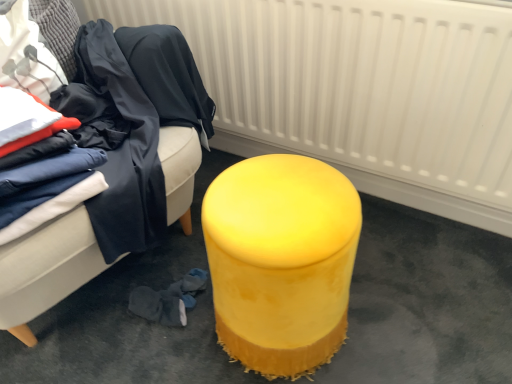
The height and width of the screenshot is (384, 512). What do you see at coordinates (281, 261) in the screenshot? I see `yellow velvet ottoman at center` at bounding box center [281, 261].

Find the location of a particular element. yellow velvet ottoman at center is located at coordinates (426, 302).

Measure the distance between yellow velvet ottoman at center and camera.

The distance of yellow velvet ottoman at center from camera is 1.00 meters.

The image size is (512, 384). What are the coordinates of `velvet yellow ottoman at right` in the screenshot? It's located at (45, 271).

The width and height of the screenshot is (512, 384). In order to click on yellow velvet ottoman at center in this screenshot , I will do `click(281, 261)`.

Considering the sizes of objects white textured radiator at upper center and dark blue fabric at left in the image provided, who is shorter, white textured radiator at upper center or dark blue fabric at left?

Standing shorter between the two is dark blue fabric at left.

Are white textured radiator at upper center and dark blue fabric at left beside each other?

No, white textured radiator at upper center is not making contact with dark blue fabric at left.

Does point (385, 84) come farther from viewer compared to point (201, 89)?

That is False.

Visually, is white textured radiator at upper center positioned to the left or to the right of dark blue fabric at left?

Based on their positions, white textured radiator at upper center is located to the right of dark blue fabric at left.

Could you tell me if dark blue fabric at left is turned towards yellow velvet ottoman at center?

No, dark blue fabric at left is not facing towards yellow velvet ottoman at center.

Which is in front, point (149, 61) or point (42, 348)?

The point (149, 61) is in front.

Does dark blue fabric at left have a larger size compared to yellow velvet ottoman at center?

No, dark blue fabric at left is not bigger than yellow velvet ottoman at center.

How different are the orientations of dark blue fabric at left and yellow velvet ottoman at center in degrees?

dark blue fabric at left and yellow velvet ottoman at center are facing 70.1 degrees away from each other.

Which of these two, yellow velvet ottoman at center or white textured radiator at upper center, is smaller?

yellow velvet ottoman at center is smaller.

Choose the correct answer: Is yellow velvet ottoman at center inside white textured radiator at upper center or outside it?

yellow velvet ottoman at center is not enclosed by white textured radiator at upper center.

Is white textured radiator at upper center at the back of yellow velvet ottoman at center?

Yes, yellow velvet ottoman at center's orientation is away from white textured radiator at upper center.

You are a GUI agent. You are given a task and a screenshot of the screen. Output one action in this format:
    pyautogui.click(x=<x>, y=<y>)
    Task: Click on the stool below the white textured radiator at upper center (from the image's perspective)
    
    Given the screenshot: What is the action you would take?
    pyautogui.click(x=281, y=261)

Who is taller, white textured radiator at upper center or velvet yellow ottoman at right?

velvet yellow ottoman at right.

How many degrees apart are the facing directions of white textured radiator at upper center and velvet yellow ottoman at right?

The angle between the facing direction of white textured radiator at upper center and the facing direction of velvet yellow ottoman at right is 69.8 degrees.

Can you confirm if white textured radiator at upper center is wider than velvet yellow ottoman at right?

No, white textured radiator at upper center is not wider than velvet yellow ottoman at right.

Does point (400, 161) appear closer or farther from the camera than point (72, 291)?

Clearly, point (400, 161) is more distant from the camera than point (72, 291).

Consider the image. Is yellow velvet ottoman at center positioned with its back to white textured radiator at upper center?

yellow velvet ottoman at center is not turned away from white textured radiator at upper center.

How much distance is there between yellow velvet ottoman at center and white textured radiator at upper center?

yellow velvet ottoman at center is 16.31 inches away from white textured radiator at upper center.

Does point (458, 280) appear closer or farther from the camera than point (371, 101)?

Point (458, 280) appears to be farther away from the viewer than point (371, 101).

Is white textured radiator at upper center at the back of dark blue fabric at left?

No.

Is there a large distance between dark blue fabric at left and white textured radiator at upper center?

No, dark blue fabric at left is not far from white textured radiator at upper center.

Considering the relative positions of dark blue fabric at left and white textured radiator at upper center in the image provided, is dark blue fabric at left to the left of white textured radiator at upper center from the viewer's perspective?

Correct, you'll find dark blue fabric at left to the left of white textured radiator at upper center.

Based on their sizes in the image, would you say yellow velvet ottoman at center is bigger or smaller than yellow velvet ottoman at center?

In the image, yellow velvet ottoman at center appears to be smaller than yellow velvet ottoman at center.

Is the position of yellow velvet ottoman at center less distant than that of yellow velvet ottoman at center?

No, yellow velvet ottoman at center is further to the viewer.

Considering the relative sizes of yellow velvet ottoman at center and yellow velvet ottoman at center in the image provided, is yellow velvet ottoman at center shorter than yellow velvet ottoman at center?

In fact, yellow velvet ottoman at center may be taller than yellow velvet ottoman at center.

In the image, is yellow velvet ottoman at center on the left side or the right side of yellow velvet ottoman at center?

yellow velvet ottoman at center is to the right of yellow velvet ottoman at center.

Identify the location of radiator located on the right of dark blue fabric at left. (359, 90).

Find the location of `concrete that appears in front of the dark blue fabric at left`. concrete that appears in front of the dark blue fabric at left is located at coordinates (426, 302).

Based on the photo, from the image, which object appears to be nearer to velvet yellow ottoman at right, yellow velvet ottoman at center or yellow velvet ottoman at center?

yellow velvet ottoman at center is positioned closer to the anchor velvet yellow ottoman at right.

Based on their spatial positions, is dark blue fabric at left or yellow velvet ottoman at center further from white textured radiator at upper center?

yellow velvet ottoman at center.

Looking at the image, which one is located further to white textured radiator at upper center, dark blue fabric at left or velvet yellow ottoman at right?

The object further to white textured radiator at upper center is velvet yellow ottoman at right.

Considering their positions, is white textured radiator at upper center positioned closer to velvet yellow ottoman at right than yellow velvet ottoman at center?

The object closer to velvet yellow ottoman at right is yellow velvet ottoman at center.

When comparing their distances from velvet yellow ottoman at right, does white textured radiator at upper center or yellow velvet ottoman at center seem further?

Among the two, white textured radiator at upper center is located further to velvet yellow ottoman at right.

From the image, which object appears to be nearer to velvet yellow ottoman at right, white textured radiator at upper center or dark blue fabric at left?

dark blue fabric at left lies closer to velvet yellow ottoman at right than the other object.

Which object lies further to the anchor point dark blue fabric at left, velvet yellow ottoman at right or white textured radiator at upper center?

Based on the image, velvet yellow ottoman at right appears to be further to dark blue fabric at left.

Based on the photo, from the image, which object appears to be nearer to dark blue fabric at left, yellow velvet ottoman at center or white textured radiator at upper center?

Among the two, white textured radiator at upper center is located nearer to dark blue fabric at left.

Where is `clothing between velvet yellow ottoman at right and white textured radiator at upper center from left to right`? Image resolution: width=512 pixels, height=384 pixels. clothing between velvet yellow ottoman at right and white textured radiator at upper center from left to right is located at coordinates (168, 76).

Identify the location of stool between velvet yellow ottoman at right and white textured radiator at upper center in the horizontal direction. (281, 261).

Identify the location of concrete between velvet yellow ottoman at right and white textured radiator at upper center. (426, 302).

Image resolution: width=512 pixels, height=384 pixels. In order to click on stool that lies between white textured radiator at upper center and yellow velvet ottoman at center from top to bottom in this screenshot , I will do coord(281,261).